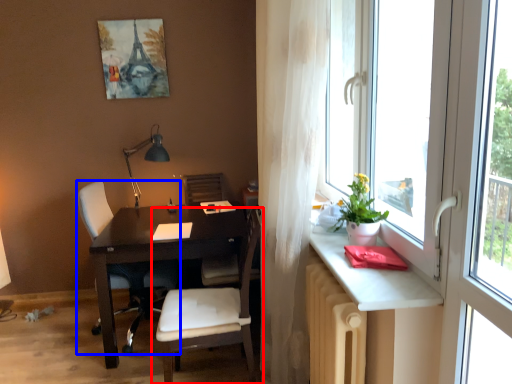
Question: Among these objects, which one is farthest to the camera, chair (highlighted by a red box) or chair (highlighted by a blue box)?

Choices:
 (A) chair
 (B) chair

Answer: (B)